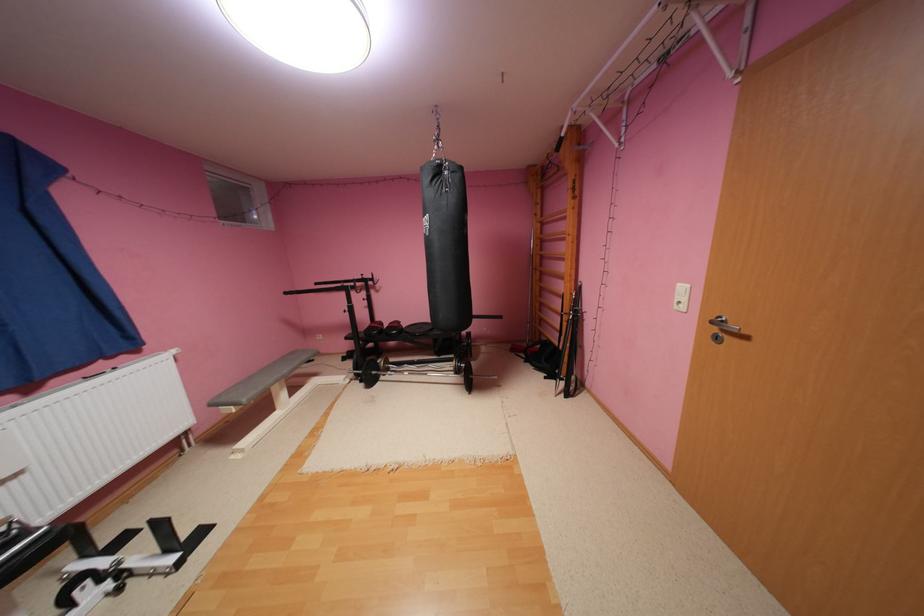
Where would you grip the black pull-down bar? Please return your answer as a coordinate pair (x, y).

(419, 371)